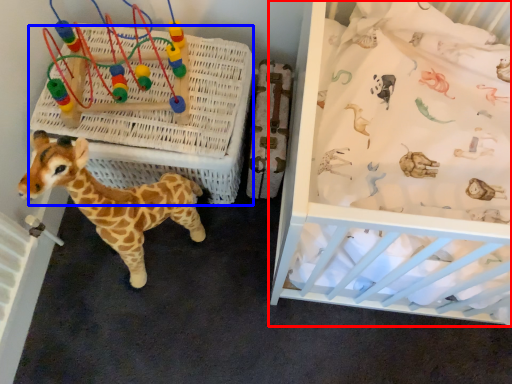
Question: Which of the following is the closest to the observer, infant bed (highlighted by a red box) or crate (highlighted by a blue box)?

Choices:
 (A) infant bed
 (B) crate

Answer: (A)